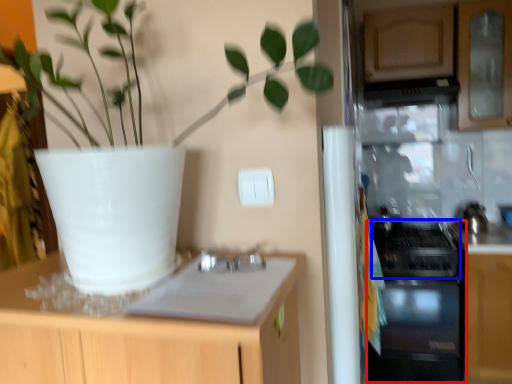
Question: Among these objects, which one is nearest to the camera, oven (highlighted by a red box) or gas stove (highlighted by a blue box)?

Choices:
 (A) oven
 (B) gas stove

Answer: (B)